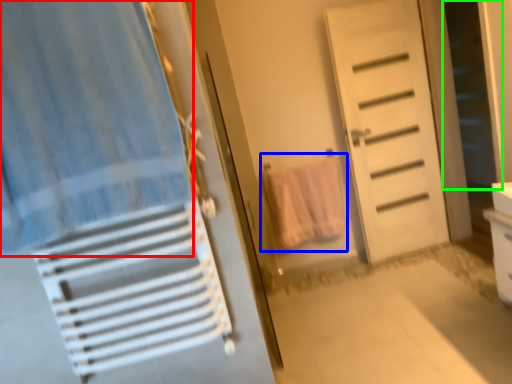
Question: Which is farther away from curtain (highlighted by a red box)? beach towel (highlighted by a blue box) or screen door (highlighted by a green box)?

Choices:
 (A) beach towel
 (B) screen door

Answer: (B)